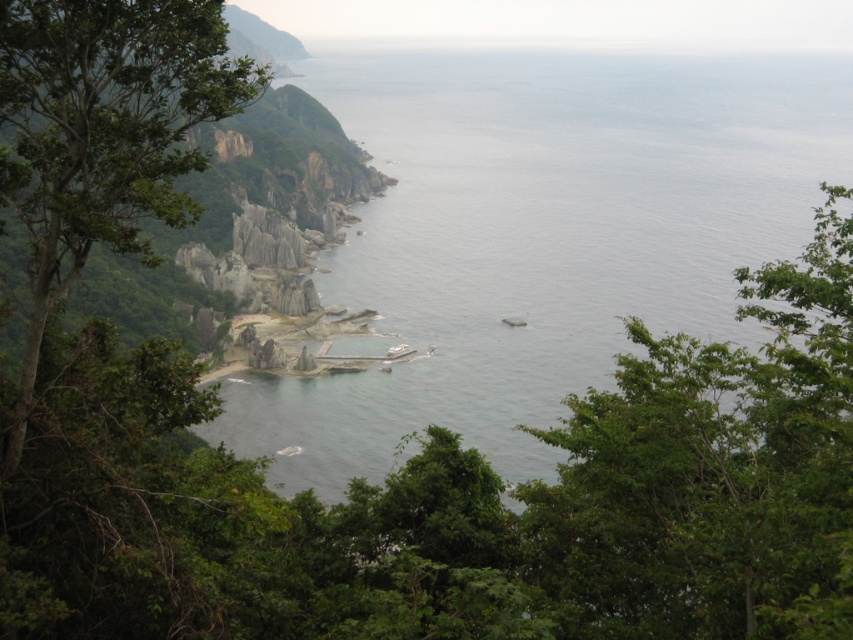
Can you confirm if clear blue water at center is positioned to the right of green leafy tree at left?

Indeed, clear blue water at center is positioned on the right side of green leafy tree at left.

From the picture: Between clear blue water at center and green leafy tree at left, which one appears on the left side from the viewer's perspective?

From the viewer's perspective, green leafy tree at left appears more on the left side.

What do you see at coordinates (538, 236) in the screenshot?
I see `clear blue water at center` at bounding box center [538, 236].

You are a GUI agent. You are given a task and a screenshot of the screen. Output one action in this format:
    pyautogui.click(x=<x>, y=<y>)
    Task: Click on the clear blue water at center
    The width and height of the screenshot is (853, 640).
    Given the screenshot: What is the action you would take?
    pyautogui.click(x=538, y=236)

Does point (350, 621) lie in front of point (109, 58)?

That is True.

The height and width of the screenshot is (640, 853). I want to click on green leafy tree at center, so click(x=459, y=500).

Does green leafy tree at center come behind clear blue water at center?

No, it is not.

Based on the photo, who is more distant from viewer, (606,566) or (444,76)?

Point (444,76)

Does point (320, 600) come closer to viewer compared to point (624, 116)?

Yes, point (320, 600) is in front of point (624, 116).

At what (x,y) coordinates should I click in order to perform the action: click on green leafy tree at center. Please return your answer as a coordinate pair (x, y). Looking at the image, I should click on (459, 500).